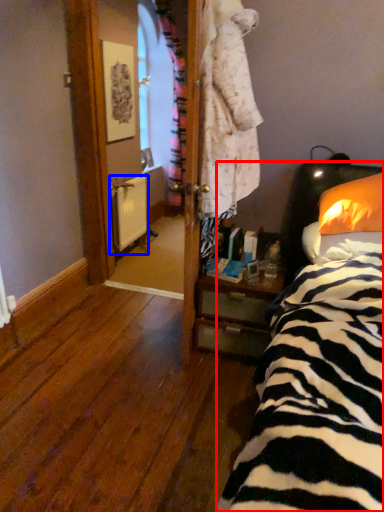
Question: Which point is further to the camera, bed (highlighted by a red box) or radiator (highlighted by a blue box)?

Choices:
 (A) bed
 (B) radiator

Answer: (B)